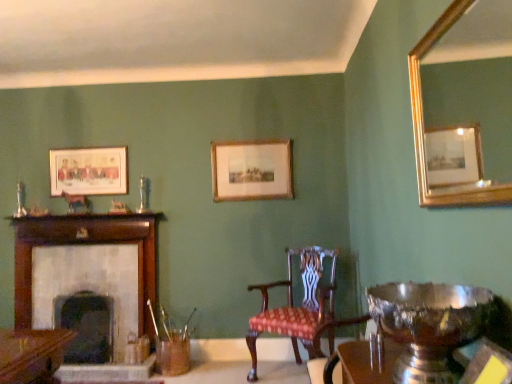
Locate an element on the screen. The image size is (512, 384). gold-framed mirror at upper right is located at coordinates (464, 106).

Measure the distance between gold-framed picture at center, the first picture frame from the right, and camera.

The distance of gold-framed picture at center, the first picture frame from the right, from camera is 3.80 meters.

Where is `mahogany wood chair at center`? mahogany wood chair at center is located at coordinates (300, 308).

Locate an element on the screen. gold-framed mirror at upper right is located at coordinates (464, 106).

Considering the relative sizes of dark gray stone fireplace at left, the 1th fireplace in the right-to-left sequence, and white stone fireplace at left, the 1th fireplace when ordered from left to right, in the image provided, is dark gray stone fireplace at left, the 1th fireplace in the right-to-left sequence, thinner than white stone fireplace at left, the 1th fireplace when ordered from left to right,?

Incorrect, the width of dark gray stone fireplace at left, the 1th fireplace in the right-to-left sequence, is not less than that of white stone fireplace at left, the 1th fireplace when ordered from left to right.

Is dark gray stone fireplace at left, the 1th fireplace in the right-to-left sequence, facing towards white stone fireplace at left, the second fireplace viewed from the right?

Yes.

Does dark gray stone fireplace at left, acting as the 2th fireplace starting from the left, come behind white stone fireplace at left, the second fireplace viewed from the right?

No.

Does dark gray stone fireplace at left, the 1th fireplace in the right-to-left sequence, have a lesser height compared to white stone fireplace at left, the 1th fireplace when ordered from left to right?

Yes, dark gray stone fireplace at left, the 1th fireplace in the right-to-left sequence, is shorter than white stone fireplace at left, the 1th fireplace when ordered from left to right.

From a real-world perspective, does matte wooden picture frame at upper left, which is the 2th picture frame in front-to-back order, sit lower than white stone fireplace at left, the second fireplace viewed from the right?

No.

Are matte wooden picture frame at upper left, which is the 2th picture frame in front-to-back order, and white stone fireplace at left, the second fireplace viewed from the right, located far from each other?

No, there isn't a large distance between matte wooden picture frame at upper left, which is the 2th picture frame in front-to-back order, and white stone fireplace at left, the second fireplace viewed from the right.

Is matte wooden picture frame at upper left, arranged as the 1th picture frame when viewed from the left, facing away from white stone fireplace at left, the 1th fireplace when ordered from left to right?

No, matte wooden picture frame at upper left, arranged as the 1th picture frame when viewed from the left,'s orientation is not away from white stone fireplace at left, the 1th fireplace when ordered from left to right.

This screenshot has width=512, height=384. What are the coordinates of `chair that is behind the gold-framed mirror at upper right` in the screenshot? It's located at (300, 308).

Which is closer, (493, 12) or (333, 314)?

Point (493, 12)

From the image's perspective, is gold-framed mirror at upper right beneath mahogany wood chair at center?

No.

Measure the distance between gold-framed mirror at upper right and mahogany wood chair at center.

They are 1.67 meters apart.

From the image's perspective, does white stone fireplace at left, the second fireplace viewed from the right, appear higher than gold-framed mirror at upper right?

Incorrect, from the image's perspective, white stone fireplace at left, the second fireplace viewed from the right, is lower than gold-framed mirror at upper right.

Is white stone fireplace at left, the second fireplace viewed from the right, thinner than gold-framed mirror at upper right?

No.

Is white stone fireplace at left, the second fireplace viewed from the right, turned away from gold-framed mirror at upper right?

No, white stone fireplace at left, the second fireplace viewed from the right, is not facing away from gold-framed mirror at upper right.

Relative to gold-framed mirror at upper right, is white stone fireplace at left, the 1th fireplace when ordered from left to right, in front or behind?

Clearly, white stone fireplace at left, the 1th fireplace when ordered from left to right, is behind gold-framed mirror at upper right.

Looking at this image, is gold-framed picture at center, the first picture frame from the right, with dark gray stone fireplace at left, acting as the 2th fireplace starting from the left?

gold-framed picture at center, the first picture frame from the right, and dark gray stone fireplace at left, acting as the 2th fireplace starting from the left, are not in contact.

Based on their positions, is gold-framed picture at center, arranged as the 2th picture frame when viewed from the back, located to the left or right of dark gray stone fireplace at left, the 1th fireplace in the right-to-left sequence?

In the image, gold-framed picture at center, arranged as the 2th picture frame when viewed from the back, appears on the right side of dark gray stone fireplace at left, the 1th fireplace in the right-to-left sequence.

Is point (250, 184) closer to camera compared to point (113, 302)?

No, (250, 184) is further to viewer.

Is gold-framed picture at center, which is the 2th picture frame in left-to-right order, looking in the opposite direction of dark gray stone fireplace at left, acting as the 2th fireplace starting from the left?

No, gold-framed picture at center, which is the 2th picture frame in left-to-right order, is not facing away from dark gray stone fireplace at left, acting as the 2th fireplace starting from the left.

From a real-world perspective, which is physically above, gold-framed mirror at upper right or gold-framed picture at center, the first picture frame from the right?

In real-world perspective, gold-framed picture at center, the first picture frame from the right, is above.

Consider the image. Is gold-framed mirror at upper right positioned with its back to gold-framed picture at center, the first picture frame from the right?

No, gold-framed picture at center, the first picture frame from the right, is not at the back of gold-framed mirror at upper right.

From the picture: Would you say gold-framed mirror at upper right is inside or outside gold-framed picture at center, the first picture frame from the right?

gold-framed mirror at upper right cannot be found inside gold-framed picture at center, the first picture frame from the right.

Considering the sizes of gold-framed mirror at upper right and gold-framed picture at center, arranged as the 2th picture frame when viewed from the back, in the image, is gold-framed mirror at upper right wider or thinner than gold-framed picture at center, arranged as the 2th picture frame when viewed from the back,?

Clearly, gold-framed mirror at upper right has more width compared to gold-framed picture at center, arranged as the 2th picture frame when viewed from the back.

From the image's perspective, between gold-framed picture at center, arranged as the 2th picture frame when viewed from the back, and matte wooden picture frame at upper left, arranged as the 1th picture frame when viewed from the left, which one is located above?

gold-framed picture at center, arranged as the 2th picture frame when viewed from the back, from the image's perspective.

Is gold-framed picture at center, arranged as the 2th picture frame when viewed from the back, facing away from matte wooden picture frame at upper left, arranged as the 1th picture frame when viewed from the left?

No, gold-framed picture at center, arranged as the 2th picture frame when viewed from the back,'s orientation is not away from matte wooden picture frame at upper left, arranged as the 1th picture frame when viewed from the left.

Between point (265, 178) and point (122, 153), which one is positioned behind?

Positioned behind is point (122, 153).

Can you confirm if gold-framed picture at center, acting as the 1th picture frame starting from the front, is shorter than matte wooden picture frame at upper left, arranged as the 1th picture frame when viewed from the left?

Incorrect, the height of gold-framed picture at center, acting as the 1th picture frame starting from the front, does not fall short of that of matte wooden picture frame at upper left, arranged as the 1th picture frame when viewed from the left.

The image size is (512, 384). Find the location of `fireplace that is above the dark gray stone fireplace at left, acting as the 2th fireplace starting from the left (from the image's perspective)`. fireplace that is above the dark gray stone fireplace at left, acting as the 2th fireplace starting from the left (from the image's perspective) is located at coordinates (87, 268).

Image resolution: width=512 pixels, height=384 pixels. Find the location of `picture frame that appears on the left of white stone fireplace at left, the second fireplace viewed from the right`. picture frame that appears on the left of white stone fireplace at left, the second fireplace viewed from the right is located at coordinates (89, 171).

Estimate the real-world distances between objects in this image. Which object is closer to gold-framed mirror at upper right, mahogany wood chair at center or dark gray stone fireplace at left, the 1th fireplace in the right-to-left sequence?

mahogany wood chair at center.

Which object lies nearer to the anchor point matte wooden picture frame at upper left, arranged as the 1th picture frame when viewed from the left, gold-framed picture at center, the first picture frame from the right, or mahogany wood chair at center?

gold-framed picture at center, the first picture frame from the right, is closer to matte wooden picture frame at upper left, arranged as the 1th picture frame when viewed from the left.

Which object lies further to the anchor point gold-framed picture at center, acting as the 1th picture frame starting from the front, gold-framed mirror at upper right or mahogany wood chair at center?

gold-framed mirror at upper right.

In the scene shown: Which object lies nearer to the anchor point mahogany wood chair at center, white stone fireplace at left, the second fireplace viewed from the right, or gold-framed picture at center, arranged as the 2th picture frame when viewed from the back?

gold-framed picture at center, arranged as the 2th picture frame when viewed from the back.

From the image, which object appears to be farther from white stone fireplace at left, the 1th fireplace when ordered from left to right, mahogany wood chair at center or dark gray stone fireplace at left, the 1th fireplace in the right-to-left sequence?

The object further to white stone fireplace at left, the 1th fireplace when ordered from left to right, is mahogany wood chair at center.

Looking at this image, estimate the real-world distances between objects in this image. Which object is further from matte wooden picture frame at upper left, the 2th picture frame from the right, mahogany wood chair at center or dark gray stone fireplace at left, the 1th fireplace in the right-to-left sequence?

mahogany wood chair at center.

When comparing their distances from gold-framed picture at center, acting as the 1th picture frame starting from the front, does matte wooden picture frame at upper left, arranged as the 1th picture frame when viewed from the back, or dark gray stone fireplace at left, the 1th fireplace in the right-to-left sequence, seem further?

Among the two, dark gray stone fireplace at left, the 1th fireplace in the right-to-left sequence, is located further to gold-framed picture at center, acting as the 1th picture frame starting from the front.

From the image, which object appears to be farther from gold-framed picture at center, the first picture frame from the right, gold-framed mirror at upper right or white stone fireplace at left, the 1th fireplace when ordered from left to right?

The object further to gold-framed picture at center, the first picture frame from the right, is gold-framed mirror at upper right.

Identify the location of fireplace between white stone fireplace at left, the 1th fireplace when ordered from left to right, and gold-framed picture at center, acting as the 1th picture frame starting from the front, from left to right. Image resolution: width=512 pixels, height=384 pixels. [x=86, y=326].

The height and width of the screenshot is (384, 512). I want to click on chair between gold-framed mirror at upper right and matte wooden picture frame at upper left, arranged as the 1th picture frame when viewed from the back, in the front-back direction, so (x=300, y=308).

I want to click on fireplace positioned between gold-framed mirror at upper right and white stone fireplace at left, the 1th fireplace when ordered from left to right, from near to far, so click(x=86, y=326).

Where is `picture frame between dark gray stone fireplace at left, acting as the 2th fireplace starting from the left, and mahogany wood chair at center`? picture frame between dark gray stone fireplace at left, acting as the 2th fireplace starting from the left, and mahogany wood chair at center is located at coordinates (251, 170).